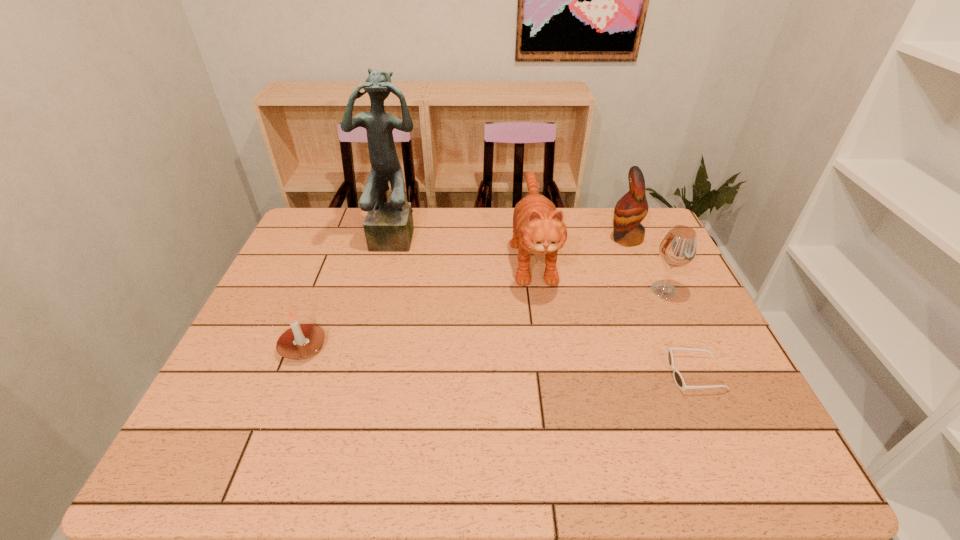
At what (x,y) coordinates should I click in order to perform the action: click on the second object from left to right. Please return your answer as a coordinate pair (x, y). The width and height of the screenshot is (960, 540). Looking at the image, I should click on (388, 227).

I want to click on sculpture, so click(x=388, y=227).

You are a GUI agent. You are given a task and a screenshot of the screen. Output one action in this format:
    pyautogui.click(x=<x>, y=<y>)
    Task: Click on the cat
    
    Given the screenshot: What is the action you would take?
    pyautogui.click(x=538, y=227)

Locate an element on the screen. The image size is (960, 540). parrot is located at coordinates (632, 208).

The height and width of the screenshot is (540, 960). What are the coordinates of `wineglass` in the screenshot? It's located at (678, 248).

Image resolution: width=960 pixels, height=540 pixels. I want to click on candle, so click(300, 341).

Identify the location of the leftmost object. 300,341.

The width and height of the screenshot is (960, 540). Find the location of `the shortest object`. the shortest object is located at coordinates (678, 378).

The height and width of the screenshot is (540, 960). Find the location of `vacant area situated 0.320m on the face of the sculpture`. vacant area situated 0.320m on the face of the sculpture is located at coordinates (376, 330).

At what (x,y) coordinates should I click in order to perform the action: click on vacant region located 0.220m on the face of the fourth object from right to left. Please return your answer as a coordinate pair (x, y). Looking at the image, I should click on (549, 368).